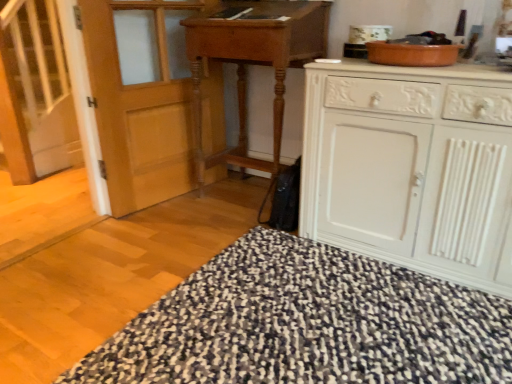
Describe the element at coordinates (307, 324) in the screenshot. I see `black textured rug at lower center` at that location.

The width and height of the screenshot is (512, 384). Describe the element at coordinates (253, 63) in the screenshot. I see `wooden table at center` at that location.

Find the location of a particular element. The height and width of the screenshot is (384, 512). white painted wood cabinet at right is located at coordinates (412, 167).

From a real-world perspective, which is physically below, white wooden stairs at left or wooden table at center?

From a 3D spatial view, wooden table at center is below.

Based on the photo, from the image's perspective, is white wooden stairs at left positioned above or below wooden table at center?

white wooden stairs at left is above wooden table at center.

Based on their positions, is white wooden stairs at left located to the left or right of wooden table at center?

Clearly, white wooden stairs at left is on the left of wooden table at center in the image.

Does white wooden stairs at left turn towards wooden table at center?

No, white wooden stairs at left is not aimed at wooden table at center.

Choose the correct answer: Is white painted wood cabinet at right inside wooden table at center or outside it?

white painted wood cabinet at right is spatially situated outside wooden table at center.

From the image's perspective, which is below, white painted wood cabinet at right or wooden table at center?

white painted wood cabinet at right is shown below in the image.

Which is in front, point (360, 249) or point (274, 157)?

The point (360, 249) is closer.

Considering the sizes of objects white painted wood cabinet at right and wooden table at center in the image provided, who is bigger, white painted wood cabinet at right or wooden table at center?

white painted wood cabinet at right is bigger.

Which of these two, black textured rug at lower center or white wooden stairs at left, stands shorter?

With less height is black textured rug at lower center.

From a real-world perspective, which object rests below the other?

From a 3D spatial view, black textured rug at lower center is below.

Is point (510, 315) in front of point (17, 164)?

Yes, point (510, 315) is in front of point (17, 164).

Is black textured rug at lower center not inside white wooden stairs at left?

Absolutely, black textured rug at lower center is external to white wooden stairs at left.

From the image's perspective, which one is positioned lower, wooden table at center or black textured rug at lower center?

black textured rug at lower center appears lower in the image.

Between wooden table at center and black textured rug at lower center, which one has more height?

wooden table at center is taller.

Looking at this image, is wooden table at center wider or thinner than black textured rug at lower center?

wooden table at center is thinner than black textured rug at lower center.

Considering the positions of points (37, 28) and (230, 248), is point (37, 28) closer to camera compared to point (230, 248)?

No, (37, 28) is further to viewer.

The image size is (512, 384). I want to click on blanket located in front of the white wooden stairs at left, so [x=307, y=324].

From the picture: Relative to black textured rug at lower center, is white wooden stairs at left in front or behind?

Visually, white wooden stairs at left is located behind black textured rug at lower center.

How much distance is there between white wooden stairs at left and black textured rug at lower center?

white wooden stairs at left and black textured rug at lower center are 7.83 feet apart.

Which of these two, wooden table at center or white wooden stairs at left, is thinner?

white wooden stairs at left.

From a real-world perspective, who is located higher, wooden table at center or white wooden stairs at left?

white wooden stairs at left is physically above.

Is wooden table at center next to white wooden stairs at left?

No, wooden table at center is not in contact with white wooden stairs at left.

Between wooden table at center and white wooden stairs at left, which one appears on the left side from the viewer's perspective?

Positioned to the left is white wooden stairs at left.

Does black textured rug at lower center have a lesser height compared to wooden table at center?

Yes, black textured rug at lower center is shorter than wooden table at center.

Where is `blanket beneath the wooden table at center (from a real-world perspective)`? The image size is (512, 384). blanket beneath the wooden table at center (from a real-world perspective) is located at coordinates (307, 324).

Measure the distance between black textured rug at lower center and wooden table at center.

The distance of black textured rug at lower center from wooden table at center is 3.35 feet.

In the scene shown: Is black textured rug at lower center wider than wooden table at center?

Indeed, black textured rug at lower center has a greater width compared to wooden table at center.

Locate an element on the screen. table that appears below the white wooden stairs at left (from the image's perspective) is located at coordinates (253, 63).

The height and width of the screenshot is (384, 512). Identify the location of table lying behind the white painted wood cabinet at right. (253, 63).

Estimate the real-world distances between objects in this image. Which object is further from black textured rug at lower center, white wooden stairs at left or wooden table at center?

white wooden stairs at left lies further to black textured rug at lower center than the other object.

Estimate the real-world distances between objects in this image. Which object is closer to wooden table at center, white painted wood cabinet at right or white wooden stairs at left?

white painted wood cabinet at right lies closer to wooden table at center than the other object.

From the image, which object appears to be farther from black textured rug at lower center, wooden table at center or white painted wood cabinet at right?

The object further to black textured rug at lower center is wooden table at center.

Looking at this image, based on their spatial positions, is white wooden stairs at left or white painted wood cabinet at right further from black textured rug at lower center?

The object further to black textured rug at lower center is white wooden stairs at left.

When comparing their distances from wooden table at center, does black textured rug at lower center or white wooden stairs at left seem further?

Among the two, white wooden stairs at left is located further to wooden table at center.

Considering their positions, is wooden table at center positioned further to black textured rug at lower center than white wooden stairs at left?

white wooden stairs at left is positioned further to the anchor black textured rug at lower center.

Looking at the image, which one is located further to white wooden stairs at left, wooden table at center or white painted wood cabinet at right?

white painted wood cabinet at right is further to white wooden stairs at left.

From the image, which object appears to be nearer to wooden table at center, white painted wood cabinet at right or black textured rug at lower center?

white painted wood cabinet at right lies closer to wooden table at center than the other object.

Locate an element on the screen. This screenshot has width=512, height=384. table between white wooden stairs at left and white painted wood cabinet at right from left to right is located at coordinates (253, 63).

Where is `cabinetry positioned between black textured rug at lower center and wooden table at center from near to far`? This screenshot has width=512, height=384. cabinetry positioned between black textured rug at lower center and wooden table at center from near to far is located at coordinates (412, 167).

This screenshot has width=512, height=384. Identify the location of table between white wooden stairs at left and black textured rug at lower center from left to right. (253, 63).

Where is `blanket between white wooden stairs at left and white painted wood cabinet at right in the horizontal direction`? This screenshot has height=384, width=512. blanket between white wooden stairs at left and white painted wood cabinet at right in the horizontal direction is located at coordinates (307, 324).